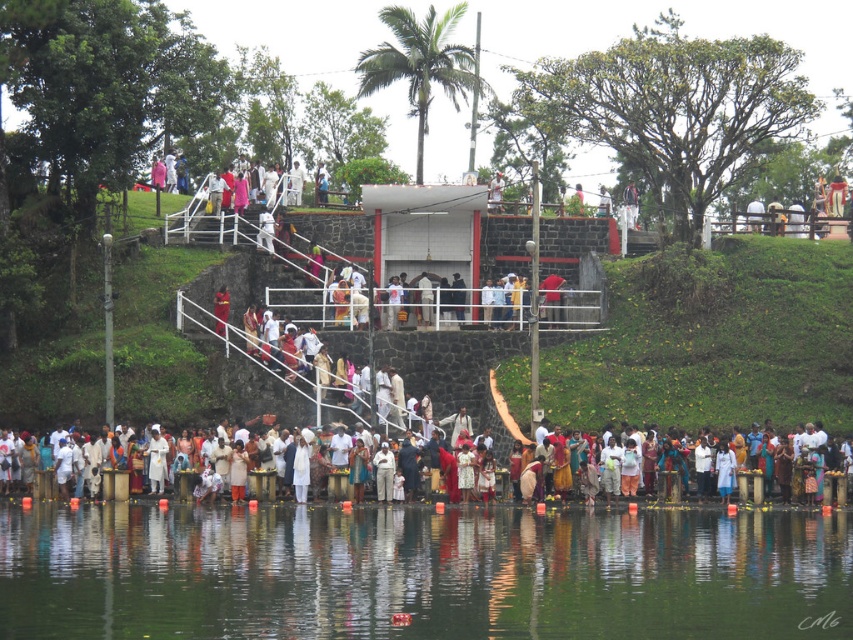
Question: Is red fabric person at center below red fabric cloth at center?

Choices:
 (A) no
 (B) yes

Answer: (A)

Question: Estimate the real-world distances between objects in this image. Which object is closer to the white clothed people at lower center?

Choices:
 (A) transparent water at lower center
 (B) red fabric cloth at center
 (C) red fabric person at center

Answer: (A)

Question: Is transparent water at lower center to the right of white clothed people at lower center from the viewer's perspective?

Choices:
 (A) yes
 (B) no

Answer: (B)

Question: Considering the real-world distances, which object is farthest from the white clothed people at lower center?

Choices:
 (A) red fabric person at center
 (B) transparent water at lower center

Answer: (A)

Question: Is transparent water at lower center in front of white clothed people at lower center?

Choices:
 (A) yes
 (B) no

Answer: (A)

Question: Estimate the real-world distances between objects in this image. Which object is farther from the red fabric cloth at center?

Choices:
 (A) transparent water at lower center
 (B) red fabric person at center

Answer: (A)